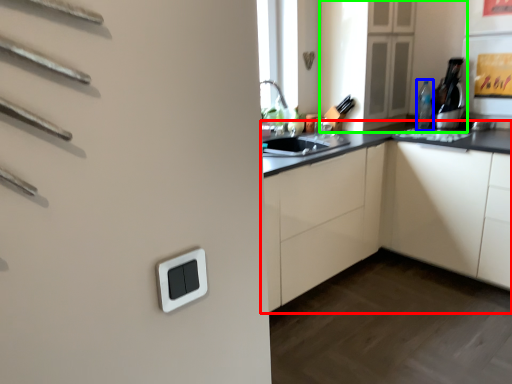
Question: Considering the real-world distances, which object is closest to cabinetry (highlighted by a red box)? bottle (highlighted by a blue box) or cabinetry (highlighted by a green box).

Choices:
 (A) bottle
 (B) cabinetry

Answer: (B)